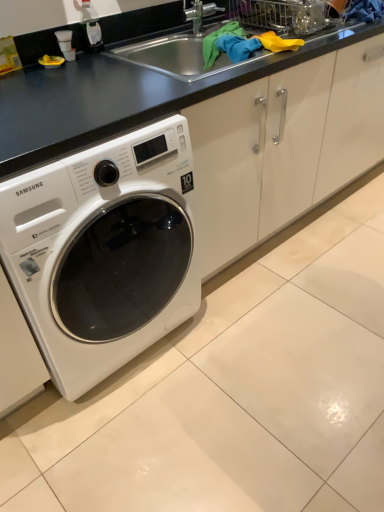
Question: Is white glossy washing machine at lower left positioned before clear plastic bottle at upper left?

Choices:
 (A) yes
 (B) no

Answer: (A)

Question: From the image's perspective, is white glossy washing machine at lower left on clear plastic bottle at upper left?

Choices:
 (A) no
 (B) yes

Answer: (A)

Question: Is white glossy washing machine at lower left wider than clear plastic bottle at upper left?

Choices:
 (A) yes
 (B) no

Answer: (A)

Question: Does white glossy washing machine at lower left contain clear plastic bottle at upper left?

Choices:
 (A) no
 (B) yes

Answer: (A)

Question: Could you tell me if white glossy washing machine at lower left is facing clear plastic bottle at upper left?

Choices:
 (A) yes
 (B) no

Answer: (B)

Question: Is clear plastic bottle at upper left spatially inside black matte counter top at upper center, or outside of it?

Choices:
 (A) inside
 (B) outside

Answer: (B)

Question: Is clear plastic bottle at upper left taller or shorter than black matte counter top at upper center?

Choices:
 (A) short
 (B) tall

Answer: (A)

Question: Considering the positions of clear plastic bottle at upper left and black matte counter top at upper center in the image, is clear plastic bottle at upper left wider or thinner than black matte counter top at upper center?

Choices:
 (A) wide
 (B) thin

Answer: (B)

Question: Considering their positions, is clear plastic bottle at upper left located in front of or behind black matte counter top at upper center?

Choices:
 (A) front
 (B) behind

Answer: (B)

Question: Would you say white glossy washing machine at lower left is inside or outside clear plastic bottle at upper left?

Choices:
 (A) outside
 (B) inside

Answer: (A)

Question: From the image's perspective, relative to clear plastic bottle at upper left, is white glossy washing machine at lower left above or below?

Choices:
 (A) below
 (B) above

Answer: (A)

Question: From a real-world perspective, is white glossy washing machine at lower left above or below clear plastic bottle at upper left?

Choices:
 (A) above
 (B) below

Answer: (B)

Question: Considering the positions of point (77, 220) and point (86, 33), is point (77, 220) closer or farther from the camera than point (86, 33)?

Choices:
 (A) closer
 (B) farther

Answer: (A)

Question: Is black matte counter top at upper center to the left or to the right of white glossy washing machine at lower left in the image?

Choices:
 (A) right
 (B) left

Answer: (A)

Question: Considering the positions of black matte counter top at upper center and white glossy washing machine at lower left in the image, is black matte counter top at upper center bigger or smaller than white glossy washing machine at lower left?

Choices:
 (A) small
 (B) big

Answer: (A)